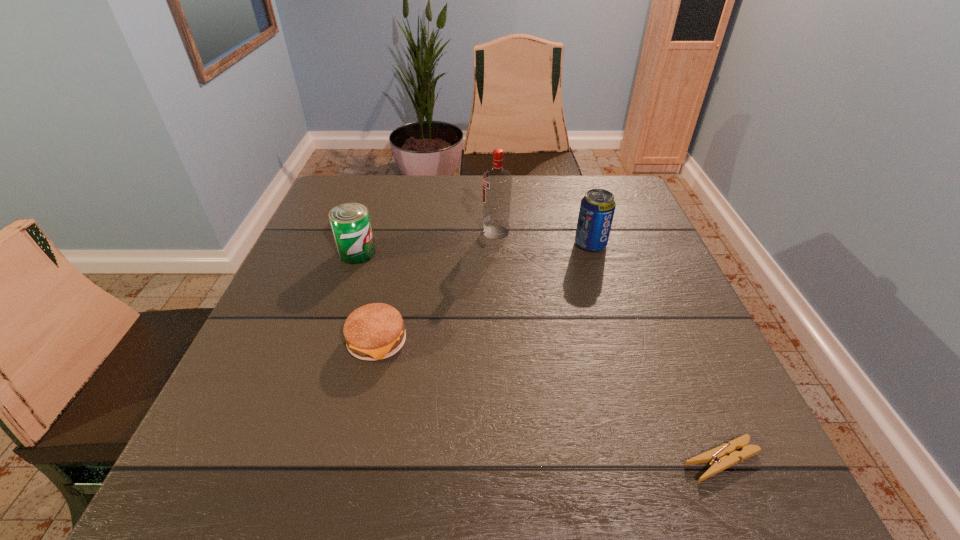
Where is `free region located on the front label of the tallest object`? The image size is (960, 540). free region located on the front label of the tallest object is located at coordinates (423, 232).

Find the location of a particular element. vacant position located 0.260m on the left of the soda is located at coordinates (468, 245).

Image resolution: width=960 pixels, height=540 pixels. I want to click on free space located 0.080m on the back of the can, so click(x=368, y=224).

Image resolution: width=960 pixels, height=540 pixels. In order to click on vacant space situated on the back of the second nearest object in this screenshot , I will do `click(397, 253)`.

Image resolution: width=960 pixels, height=540 pixels. Find the location of `blank area located 0.070m on the back of the nearest object`. blank area located 0.070m on the back of the nearest object is located at coordinates (696, 400).

Find the location of `object located at the near edge`. object located at the near edge is located at coordinates (722, 457).

The width and height of the screenshot is (960, 540). In order to click on object at the left edge in this screenshot , I will do 350,222.

Find the location of a particular element. The image size is (960, 540). soda that is at the right edge is located at coordinates (597, 207).

The image size is (960, 540). Find the location of `clothespin located at the right edge`. clothespin located at the right edge is located at coordinates (722, 457).

What are the coordinates of `object situated at the near right corner` in the screenshot? It's located at pos(722,457).